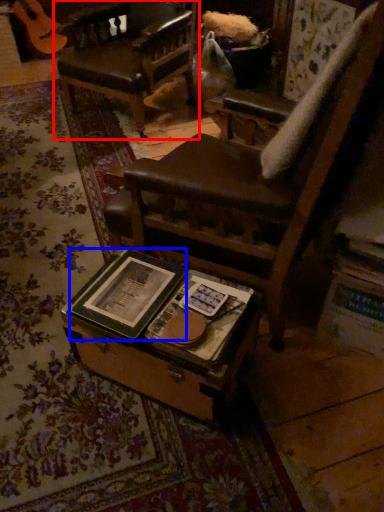
Question: Among these objects, which one is farthest to the camera, chair (highlighted by a red box) or paperback book (highlighted by a blue box)?

Choices:
 (A) chair
 (B) paperback book

Answer: (A)